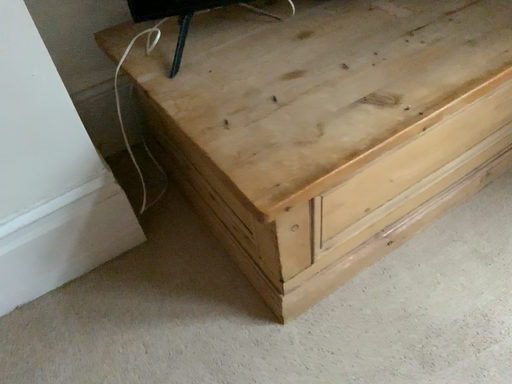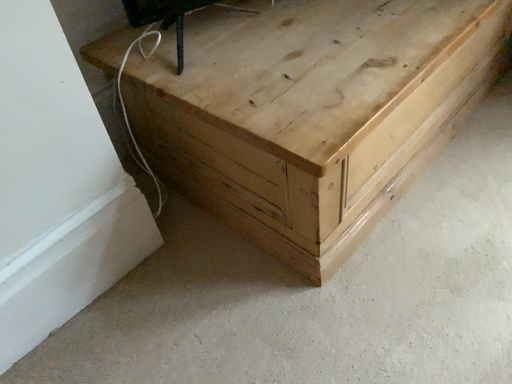
Question: How did the camera likely rotate when shooting the video?

Choices:
 (A) rotated right
 (B) rotated left

Answer: (A)